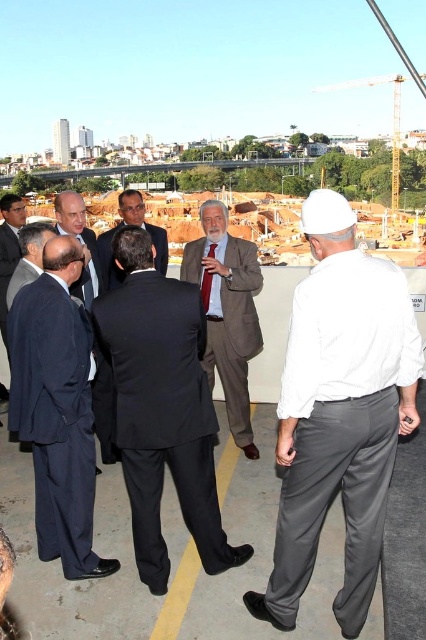
Looking at this image, can you confirm if dark blue suit at center is shorter than matte black suit at left?

Correct, dark blue suit at center is not as tall as matte black suit at left.

This screenshot has width=426, height=640. What do you see at coordinates (57, 408) in the screenshot? I see `dark blue suit at center` at bounding box center [57, 408].

Where is `dark blue suit at center`? dark blue suit at center is located at coordinates (57, 408).

How much distance is there between white matte hard hat at center and dark gray suit at center?

A distance of 15.79 meters exists between white matte hard hat at center and dark gray suit at center.

Between white matte hard hat at center and dark gray suit at center, which one appears on the left side from the viewer's perspective?

dark gray suit at center is more to the left.

This screenshot has width=426, height=640. In order to click on white matte hard hat at center in this screenshot , I will do `click(339, 412)`.

Who is shorter, dark gray suit at center or dark blue suit at left?

dark blue suit at left

Which is more to the left, dark gray suit at center or dark blue suit at left?

dark blue suit at left is more to the left.

Find the location of a particular element. dark gray suit at center is located at coordinates (161, 406).